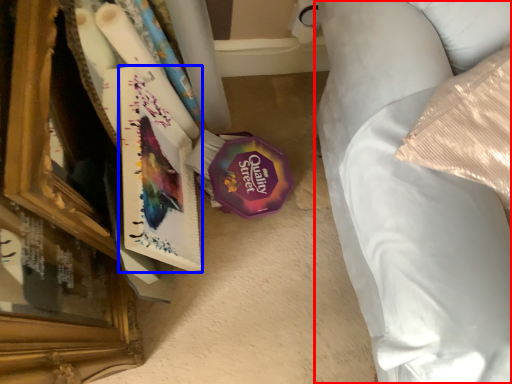
Question: Which of the following is the closest to the observer, furniture (highlighted by a red box) or paperback book (highlighted by a blue box)?

Choices:
 (A) furniture
 (B) paperback book

Answer: (A)